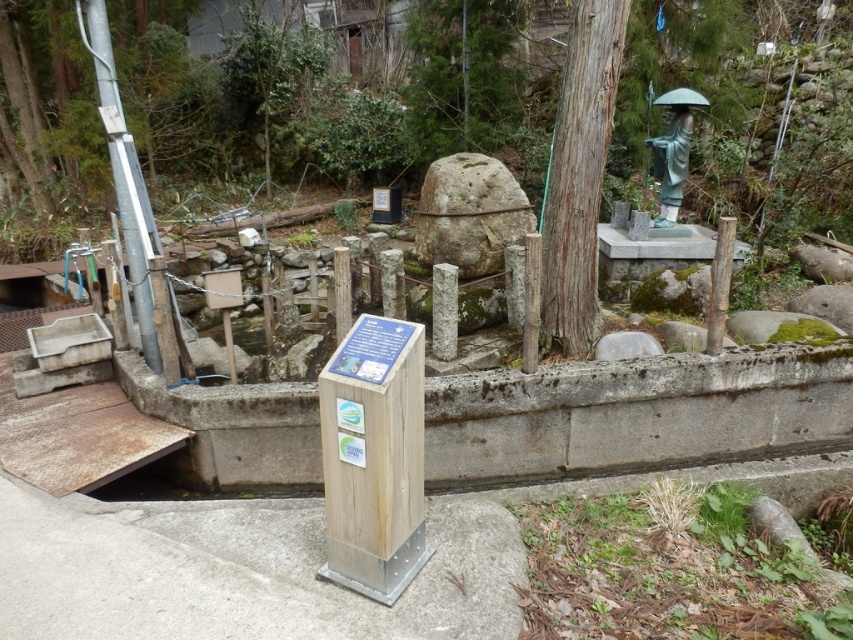
Between green mossy rock at upper center and smooth gray stone at center, which one has more height?

Standing taller between the two is green mossy rock at upper center.

Is point (498, 76) less distant than point (459, 211)?

No, it is behind (459, 211).

Where is `green mossy rock at upper center`? The height and width of the screenshot is (640, 853). green mossy rock at upper center is located at coordinates (463, 76).

How far apart are smooth gray stone at center and green patina statue at upper right?

smooth gray stone at center is 6.07 feet from green patina statue at upper right.

Does smooth gray stone at center appear under green patina statue at upper right?

Indeed, smooth gray stone at center is positioned under green patina statue at upper right.

Where is `smooth gray stone at center`? The width and height of the screenshot is (853, 640). smooth gray stone at center is located at coordinates (469, 212).

Which is below, green mossy rock at upper center or gray smooth rock at center?

gray smooth rock at center

Does green mossy rock at upper center have a smaller size compared to gray smooth rock at center?

No.

Who is more forward, (x=415, y=129) or (x=624, y=333)?

Positioned in front is point (x=624, y=333).

Image resolution: width=853 pixels, height=640 pixels. Find the location of `green mossy rock at upper center`. green mossy rock at upper center is located at coordinates (463, 76).